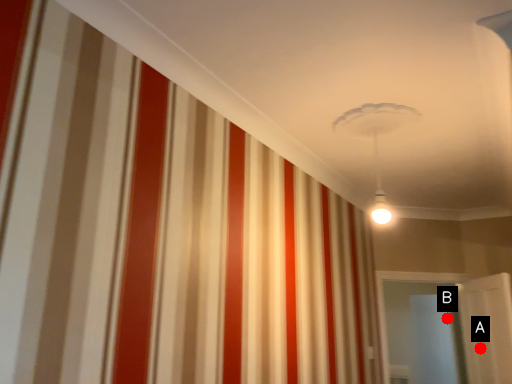
Question: Two points are circled on the image, labeled by A and B beside each circle. Which point is further to the camera?

Choices:
 (A) A is further
 (B) B is further

Answer: (B)